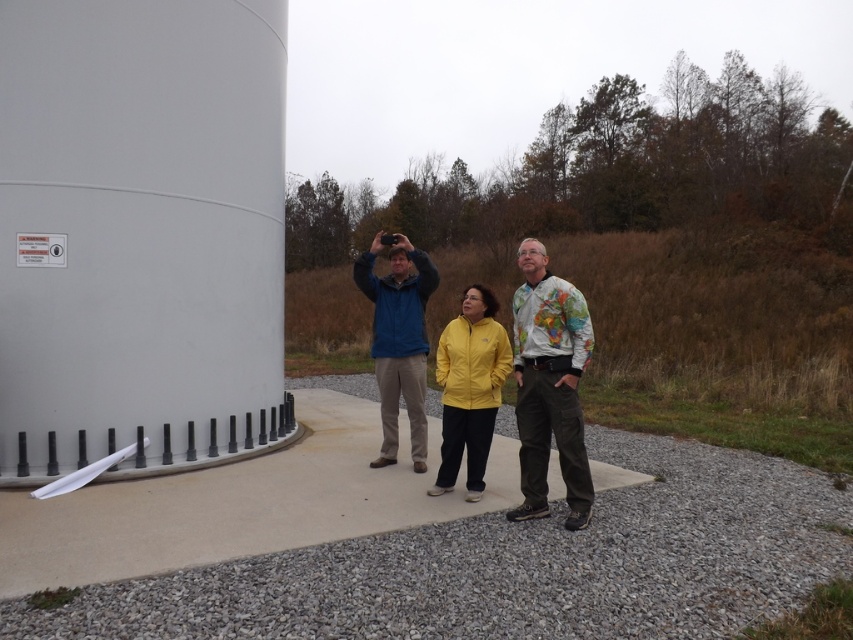
Question: From the image, what is the correct spatial relationship of white matte water tower at left in relation to blue fabric jacket at center?

Choices:
 (A) right
 (B) left

Answer: (B)

Question: Can you confirm if yellow fabric jacket at center is wider than blue fabric jacket at center?

Choices:
 (A) yes
 (B) no

Answer: (B)

Question: Can you confirm if blue fabric jacket at center is positioned to the left of yellow matte jacket at center?

Choices:
 (A) yes
 (B) no

Answer: (A)

Question: Which of the following is the farthest from the observer?

Choices:
 (A) (579, 488)
 (B) (126, 186)

Answer: (B)

Question: Among these objects, which one is nearest to the camera?

Choices:
 (A) blue fabric jacket at center
 (B) yellow matte jacket at center
 (C) white matte water tower at left

Answer: (B)

Question: Based on their relative distances, which object is nearer to the yellow matte jacket at center?

Choices:
 (A) blue fabric jacket at center
 (B) yellow fabric jacket at center
 (C) white matte water tower at left

Answer: (B)